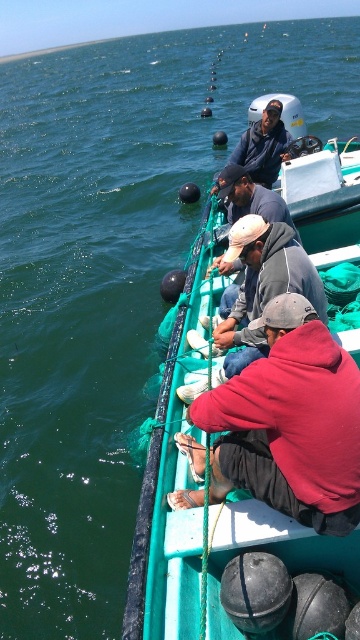
Consider the image. Between red hoodie at center and gray hoodie at center, which one has less height?

gray hoodie at center

Does red hoodie at center have a lesser width compared to gray hoodie at center?

In fact, red hoodie at center might be wider than gray hoodie at center.

At what (x,y) coordinates should I click in order to perform the action: click on red hoodie at center. Please return your answer as a coordinate pair (x, y). The image size is (360, 640). Looking at the image, I should click on (290, 422).

Can you confirm if gray hoodie at center is bigger than dark blue fabric jacket at center?

Indeed, gray hoodie at center has a larger size compared to dark blue fabric jacket at center.

Between gray hoodie at center and dark blue fabric jacket at center, which one appears on the left side from the viewer's perspective?

gray hoodie at center is more to the left.

Measure the distance between gray hoodie at center and camera.

gray hoodie at center is 4.33 meters away from camera.

You are a GUI agent. You are given a task and a screenshot of the screen. Output one action in this format:
    pyautogui.click(x=<x>, y=<y>)
    Task: Click on the gray hoodie at center
    The height and width of the screenshot is (640, 360).
    Given the screenshot: What is the action you would take?
    click(x=250, y=196)

Does red hoodie at center have a smaller size compared to dark gray hoodie at center?

Yes.

Does point (338, 419) come in front of point (280, 275)?

Yes, it is in front of point (280, 275).

Locate an element on the screen. The image size is (360, 640). red hoodie at center is located at coordinates (290, 422).